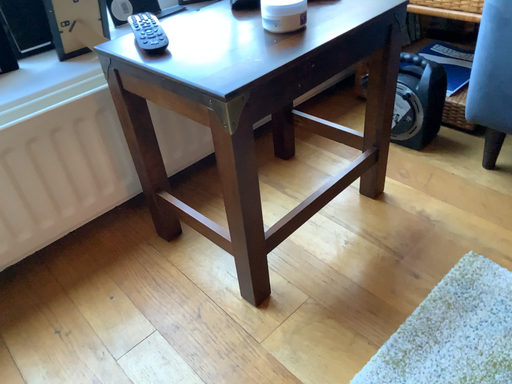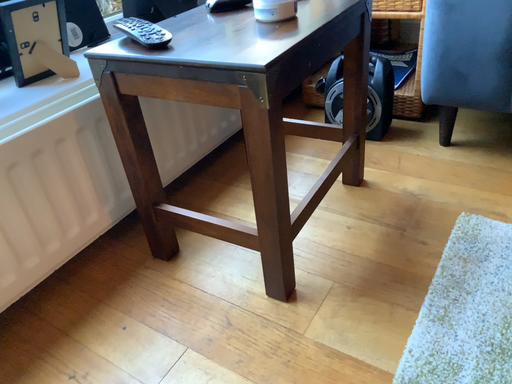
Question: How did the camera likely rotate when shooting the video?

Choices:
 (A) rotated upward
 (B) rotated downward

Answer: (A)